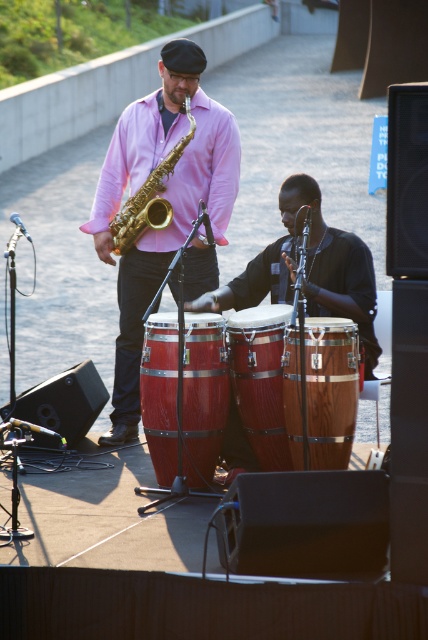
Who is taller, wooden bongo drums at center or gold shiny trumpet at center?

wooden bongo drums at center

Who is lower down, wooden bongo drums at center or gold shiny trumpet at center?

wooden bongo drums at center

Is point (354, 276) closer to viewer compared to point (157, 202)?

Yes, it is in front of point (157, 202).

The width and height of the screenshot is (428, 640). Find the location of `wooden bongo drums at center`. wooden bongo drums at center is located at coordinates (308, 269).

Is shiny wood drum at center to the left of wooden drum at center from the viewer's perspective?

Correct, you'll find shiny wood drum at center to the left of wooden drum at center.

Is shiny wood drum at center below wooden drum at center?

Yes.

Is point (196, 435) less distant than point (308, 403)?

No.

Find the location of a particular element. shiny wood drum at center is located at coordinates (204, 394).

Is matte gold saxophone at center above wooden bongo drums at center?

Correct, matte gold saxophone at center is located above wooden bongo drums at center.

Is point (115, 381) closer to viewer compared to point (294, 177)?

No.

Describe the element at coordinates (166, 198) in the screenshot. I see `matte gold saxophone at center` at that location.

Identify the location of matte gold saxophone at center. (166, 198).